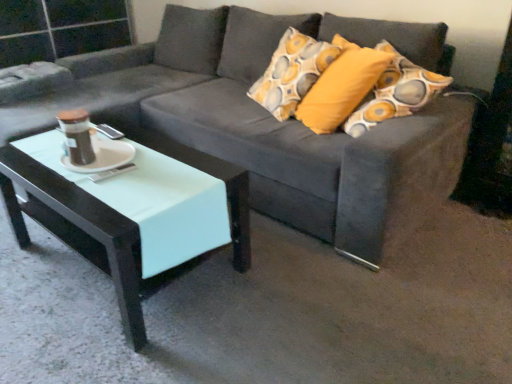
Question: Is suede gray couch at center bigger or smaller than mint glossy coffee table at lower left?

Choices:
 (A) small
 (B) big

Answer: (B)

Question: Relative to mint glossy coffee table at lower left, is suede gray couch at center in front or behind?

Choices:
 (A) behind
 (B) front

Answer: (B)

Question: Estimate the real-world distances between objects in this image. Which object is closer to the mint glossy coffee table at lower left?

Choices:
 (A) suede gray couch at center
 (B) white glossy saucer at center

Answer: (B)

Question: Which of these objects is positioned closest to the suede gray couch at center?

Choices:
 (A) white glossy saucer at center
 (B) mint glossy coffee table at lower left

Answer: (B)